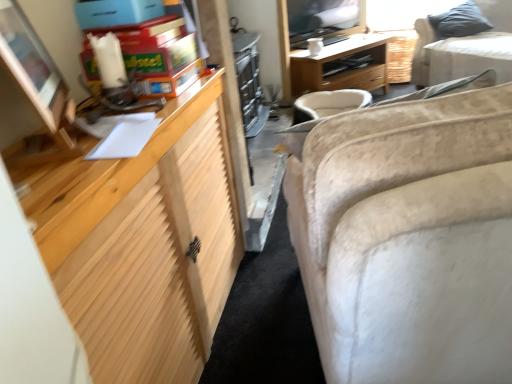
Question: Can you see beige fabric couch at upper right, which is the second studio couch in left-to-right order, touching gray fabric pillow at upper right?

Choices:
 (A) yes
 (B) no

Answer: (B)

Question: Is beige fabric couch at upper right, the first studio couch in the top-to-bottom sequence, outside of gray fabric pillow at upper right?

Choices:
 (A) yes
 (B) no

Answer: (B)

Question: Considering the relative positions of beige fabric couch at upper right, marked as the 2th studio couch in a bottom-to-top arrangement, and gray fabric pillow at upper right in the image provided, is beige fabric couch at upper right, marked as the 2th studio couch in a bottom-to-top arrangement, in front of gray fabric pillow at upper right?

Choices:
 (A) no
 (B) yes

Answer: (B)

Question: Does beige fabric couch at upper right, marked as the 2th studio couch in a bottom-to-top arrangement, appear on the right side of gray fabric pillow at upper right?

Choices:
 (A) no
 (B) yes

Answer: (A)

Question: Can you confirm if beige fabric couch at upper right, positioned as the 1th studio couch in back-to-front order, is bigger than gray fabric pillow at upper right?

Choices:
 (A) yes
 (B) no

Answer: (B)

Question: Considering the positions of beige fabric couch at upper right, which is the second studio couch in left-to-right order, and beige fabric couch at right, placed as the second studio couch when sorted from back to front, in the image, is beige fabric couch at upper right, which is the second studio couch in left-to-right order, wider or thinner than beige fabric couch at right, placed as the second studio couch when sorted from back to front,?

Choices:
 (A) thin
 (B) wide

Answer: (A)

Question: From the image's perspective, relative to beige fabric couch at right, the 2th studio couch from the right, is beige fabric couch at upper right, marked as the 2th studio couch in a bottom-to-top arrangement, above or below?

Choices:
 (A) below
 (B) above

Answer: (B)

Question: Relative to beige fabric couch at right, the 2th studio couch from the right, is beige fabric couch at upper right, which is the second studio couch in left-to-right order, in front or behind?

Choices:
 (A) front
 (B) behind

Answer: (B)

Question: In terms of size, does beige fabric couch at upper right, the 2th studio couch from the front, appear bigger or smaller than beige fabric couch at right, placed as the second studio couch when sorted from back to front?

Choices:
 (A) small
 (B) big

Answer: (A)

Question: Looking at their shapes, would you say gray fabric pillow at upper right is wider or thinner than beige fabric swivel chair at center?

Choices:
 (A) wide
 (B) thin

Answer: (B)

Question: Considering the positions of point (471, 11) and point (302, 117), is point (471, 11) closer or farther from the camera than point (302, 117)?

Choices:
 (A) farther
 (B) closer

Answer: (A)

Question: From the image's perspective, is gray fabric pillow at upper right located above or below beige fabric swivel chair at center?

Choices:
 (A) below
 (B) above

Answer: (B)

Question: Based on their positions, is gray fabric pillow at upper right located to the left or right of beige fabric swivel chair at center?

Choices:
 (A) left
 (B) right

Answer: (B)

Question: Considering the positions of beige fabric couch at upper right, the 2th studio couch from the front, and wooden desk at center in the image, is beige fabric couch at upper right, the 2th studio couch from the front, taller or shorter than wooden desk at center?

Choices:
 (A) tall
 (B) short

Answer: (B)

Question: From a real-world perspective, is beige fabric couch at upper right, positioned as the 1th studio couch in back-to-front order, above or below wooden desk at center?

Choices:
 (A) below
 (B) above

Answer: (B)